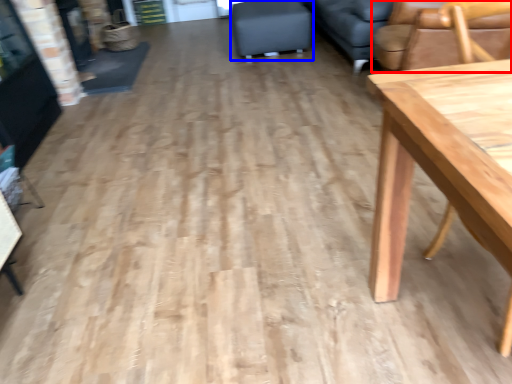
Question: Which point is closer to the camera, chair (highlighted by a red box) or swivel chair (highlighted by a blue box)?

Choices:
 (A) chair
 (B) swivel chair

Answer: (A)